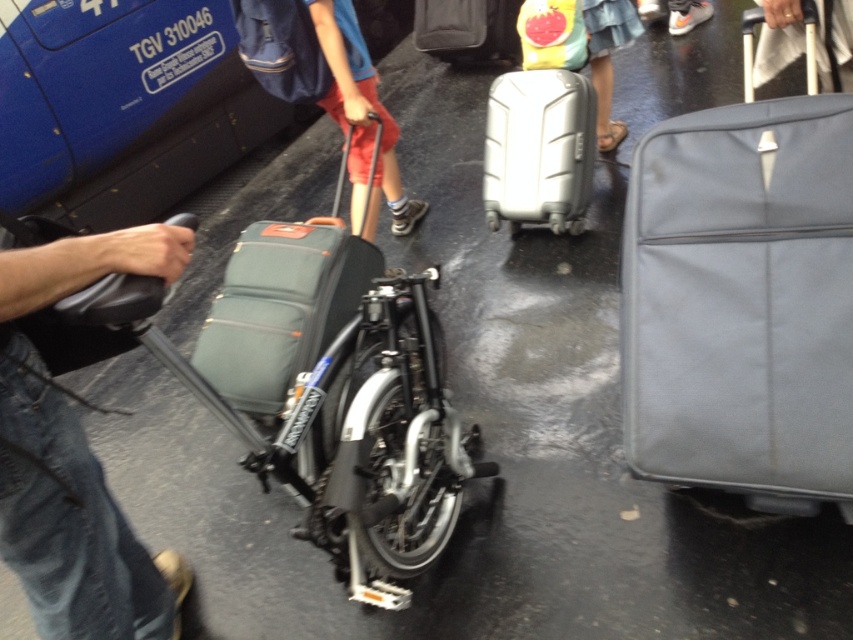
Which is in front, point (669, 474) or point (252, 353)?

Point (669, 474)

Can you confirm if matte gray suitcase at right is smaller than dark gray fabric suitcase at center?

No.

Is point (844, 182) closer to camera compared to point (346, 241)?

Yes, it is in front of point (346, 241).

You are a GUI agent. You are given a task and a screenshot of the screen. Output one action in this format:
    pyautogui.click(x=<x>, y=<y>)
    Task: Click on the matte gray suitcase at right
    The width and height of the screenshot is (853, 640).
    Given the screenshot: What is the action you would take?
    pyautogui.click(x=741, y=298)

Does black leather bag at lower left appear on the left side of denim skirt at center?

Correct, you'll find black leather bag at lower left to the left of denim skirt at center.

What do you see at coordinates (74, 458) in the screenshot?
I see `black leather bag at lower left` at bounding box center [74, 458].

Is point (21, 285) farther from viewer compared to point (587, 26)?

No, (21, 285) is in front of (587, 26).

What are the coordinates of `black leather bag at lower left` in the screenshot? It's located at (74, 458).

Which of these two, silver hardshell suitcase at center or denim skirt at center, stands shorter?

denim skirt at center is shorter.

Between point (573, 84) and point (598, 134), which one is positioned in front?

Point (573, 84) is more forward.

In order to click on silver hardshell suitcase at center in this screenshot , I will do `click(538, 148)`.